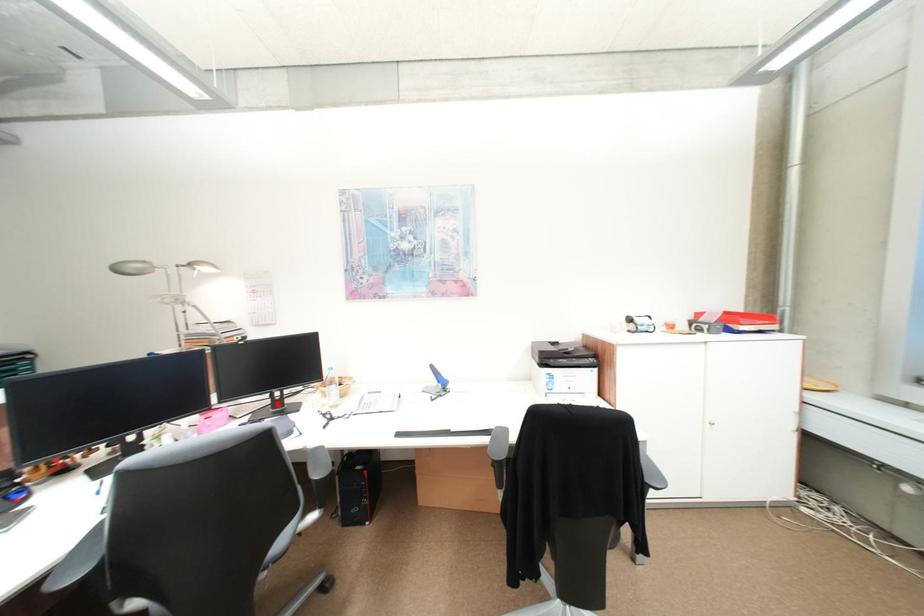
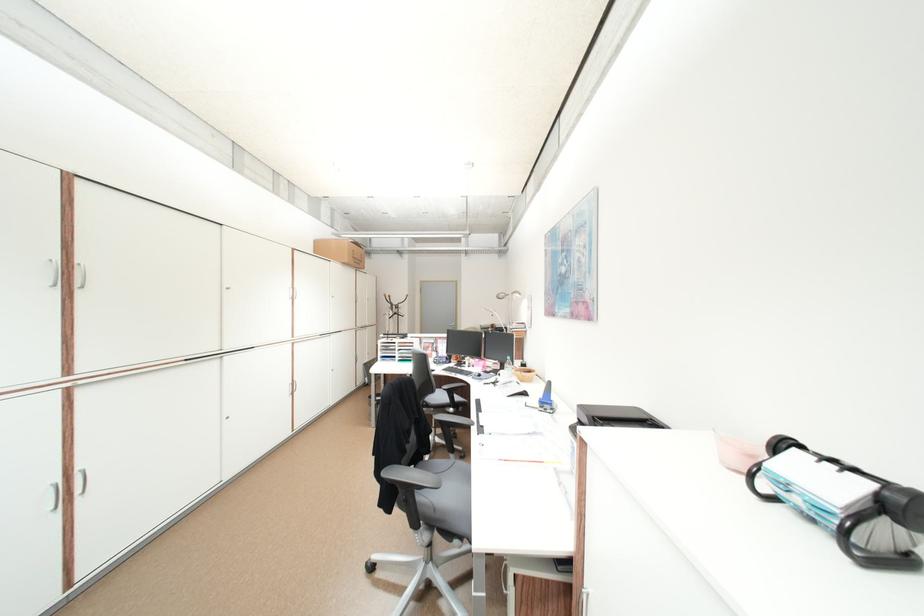
Question: I am providing you with two images of the same scene from different viewpoints. A red point is shown in image1. For the corresponding object point in image2, is it positioned nearer or farther from the camera?

Choices:
 (A) Nearer
 (B) Farther

Answer: (B)